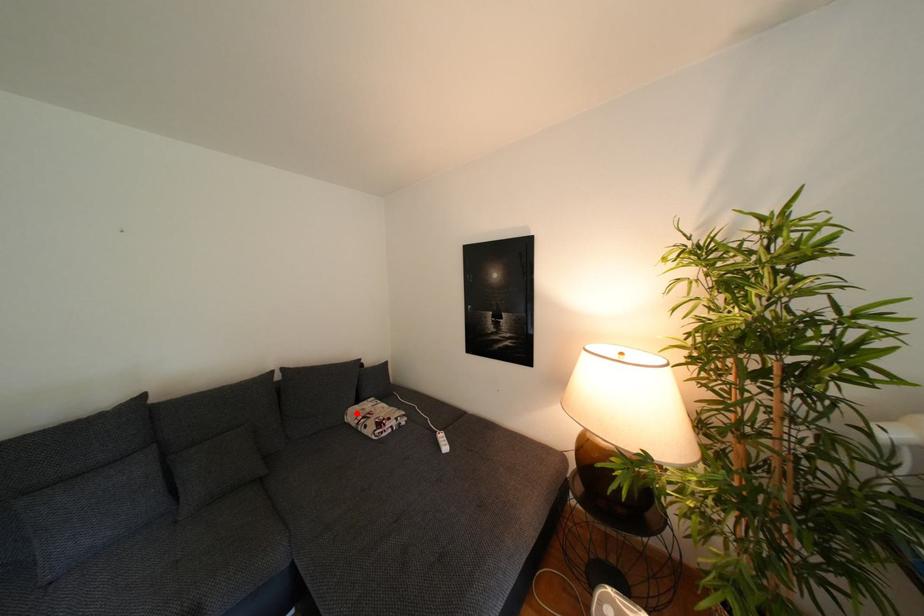
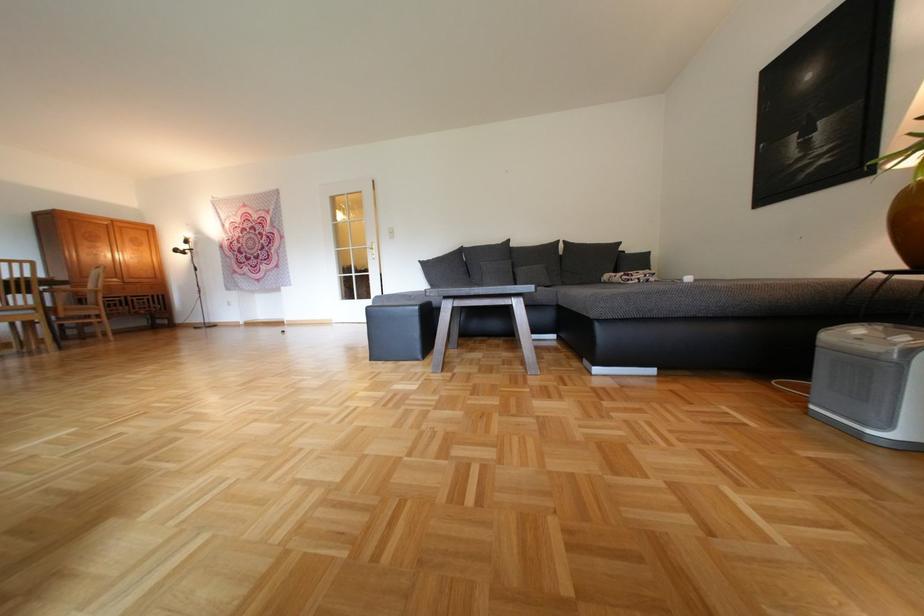
Question: I am providing you with two images of the same scene from different viewpoints. Image1 has a red point marked. In image2, the corresponding 3D location appears at what relative position? Reply with the corresponding letter.

Choices:
 (A) Closer
 (B) Farther

Answer: (A)